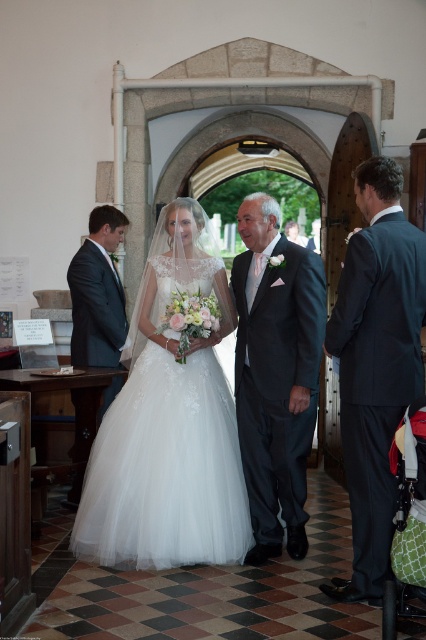
Can you confirm if white tulle dress at center is positioned to the right of matte black suit at left?

Indeed, white tulle dress at center is positioned on the right side of matte black suit at left.

Can you confirm if white tulle dress at center is positioned above matte black suit at left?

No.

Does point (239, 545) come in front of point (115, 321)?

Yes, it is in front of point (115, 321).

The height and width of the screenshot is (640, 426). Identify the location of white tulle dress at center. (170, 420).

Who is higher up, dark gray suit at center or matte black suit at left?

matte black suit at left is higher up.

Is dark gray suit at center behind matte black suit at left?

No, it is in front of matte black suit at left.

The width and height of the screenshot is (426, 640). I want to click on dark gray suit at center, so click(276, 372).

Is white satin dress at center above white tulle dress at center?

Incorrect, white satin dress at center is not positioned above white tulle dress at center.

Who is more forward, (377, 483) or (238, 484)?

Point (377, 483) is more forward.

This screenshot has height=640, width=426. I want to click on white satin dress at center, so click(319, 365).